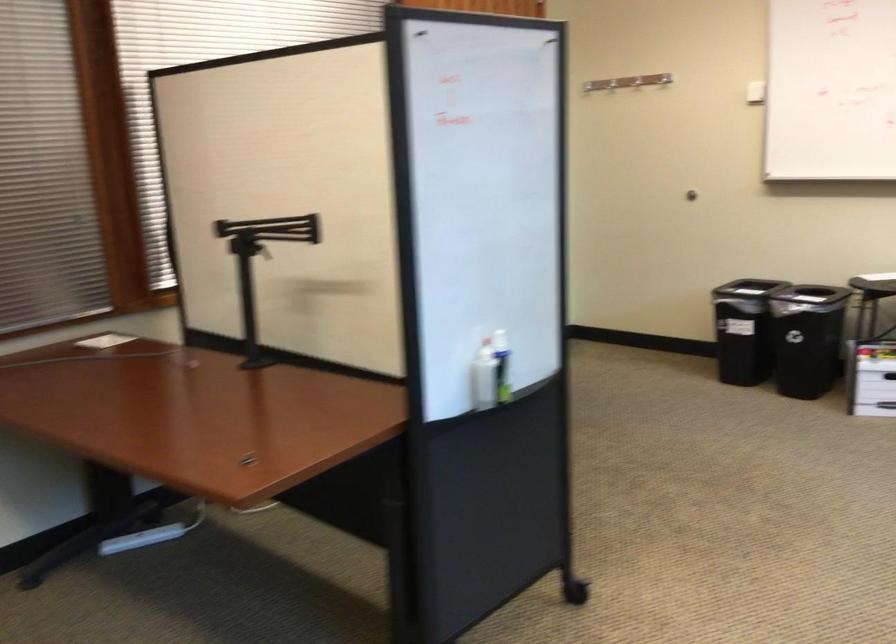
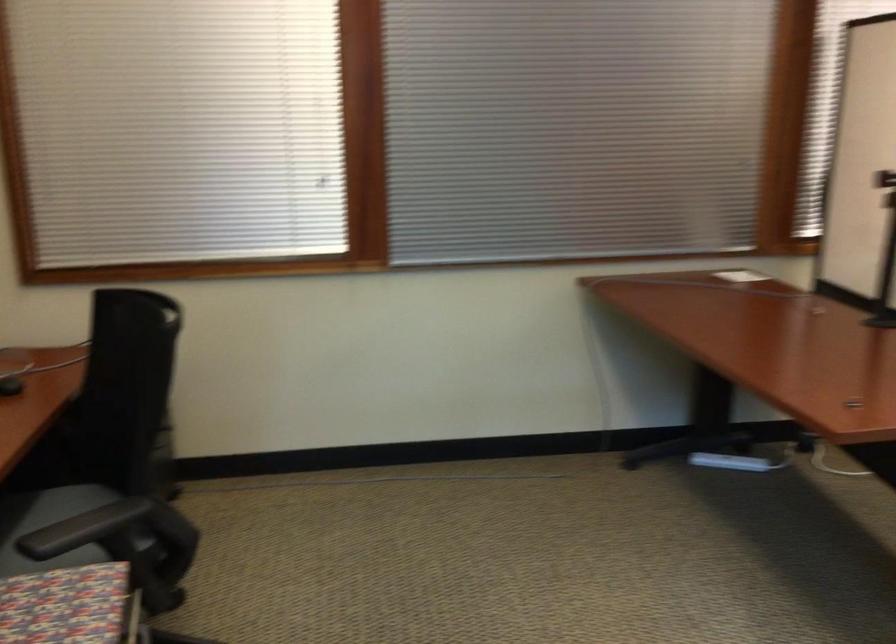
The point at (151, 533) is marked in the first image. Where is the corresponding point in the second image?

(730, 462)